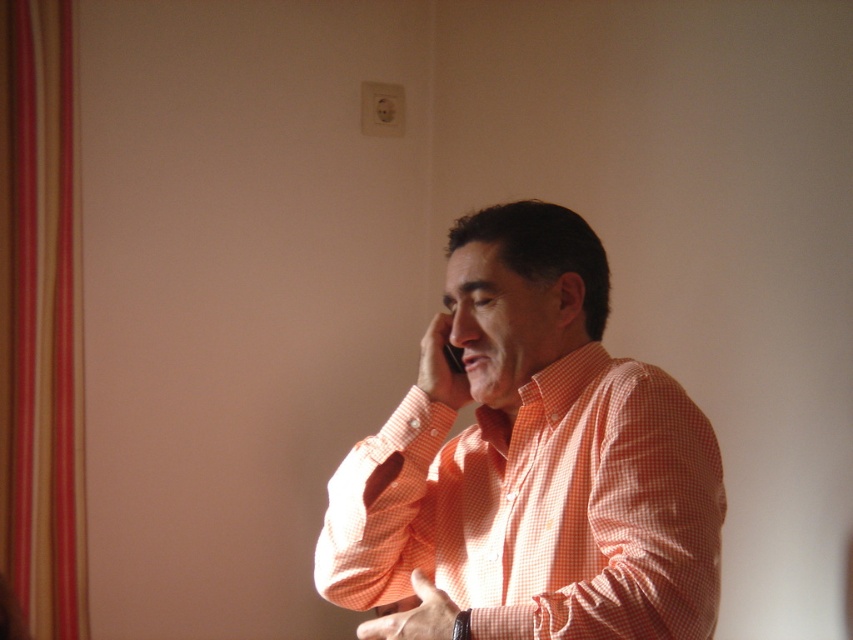
Can you confirm if orange checkered shirt at center is positioned to the left of striped fabric curtain at left?

Incorrect, orange checkered shirt at center is not on the left side of striped fabric curtain at left.

Does orange checkered shirt at center have a smaller size compared to striped fabric curtain at left?

Incorrect, orange checkered shirt at center is not smaller in size than striped fabric curtain at left.

Where is `orange checkered shirt at center`? The image size is (853, 640). orange checkered shirt at center is located at coordinates (529, 464).

At what (x,y) coordinates should I click in order to perform the action: click on orange checkered shirt at center. Please return your answer as a coordinate pair (x, y). The image size is (853, 640). Looking at the image, I should click on (529, 464).

Does point (444, 461) come closer to viewer compared to point (454, 349)?

No, (444, 461) is further to viewer.

Is orange checkered shirt at center to the left of black plastic phone at center from the viewer's perspective?

In fact, orange checkered shirt at center is to the right of black plastic phone at center.

Is point (463, 358) positioned before point (451, 349)?

Yes, it is in front of point (451, 349).

This screenshot has height=640, width=853. In order to click on orange checkered shirt at center in this screenshot , I will do `click(529, 464)`.

This screenshot has height=640, width=853. What do you see at coordinates (39, 321) in the screenshot?
I see `striped fabric curtain at left` at bounding box center [39, 321].

Consider the image. Can you confirm if striped fabric curtain at left is positioned above black plastic phone at center?

Yes.

Which is in front, point (67, 195) or point (445, 348)?

Point (445, 348) is more forward.

The width and height of the screenshot is (853, 640). Find the location of `striped fabric curtain at left`. striped fabric curtain at left is located at coordinates (39, 321).